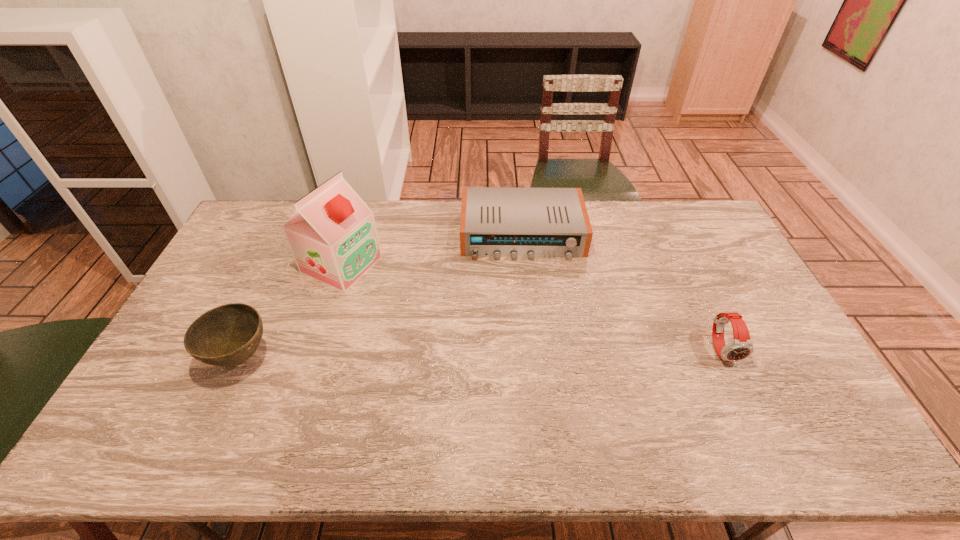
Identify the location of vacant space positioned 0.130m on the front panel of the radio receiver. (527, 289).

What are the coordinates of `vacant space located 0.350m on the front panel of the radio receiver` in the screenshot? It's located at (532, 346).

I want to click on free space located on the front panel of the radio receiver, so click(528, 311).

This screenshot has width=960, height=540. In order to click on soya milk at the far edge in this screenshot , I will do tap(332, 235).

I want to click on radio receiver that is at the far edge, so click(x=496, y=222).

Locate an element on the screen. The image size is (960, 540). object at the near edge is located at coordinates (228, 335).

I want to click on object that is at the left edge, so click(228, 335).

Image resolution: width=960 pixels, height=540 pixels. I want to click on object that is at the right edge, so click(741, 347).

Find the location of a particular element. object that is at the near left corner is located at coordinates (228, 335).

This screenshot has height=540, width=960. I want to click on free location at the near edge of the desktop, so (258, 403).